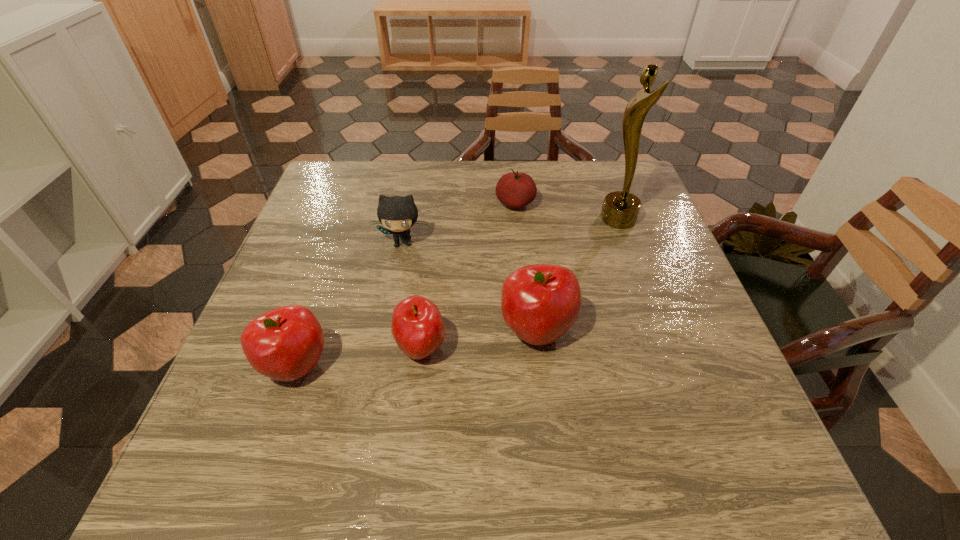
Locate an element on the screen. vacant place for an extra apple on the right is located at coordinates (645, 315).